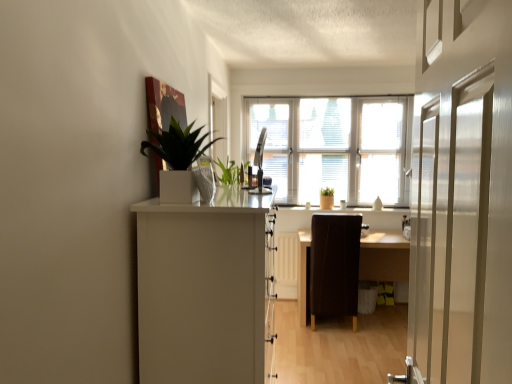
Question: Considering the relative positions of metallic silver monitor at center and wooden table at center in the image provided, is metallic silver monitor at center in front of wooden table at center?

Choices:
 (A) yes
 (B) no

Answer: (A)

Question: Is metallic silver monitor at center not near wooden table at center?

Choices:
 (A) no
 (B) yes

Answer: (B)

Question: Does metallic silver monitor at center have a larger size compared to wooden table at center?

Choices:
 (A) yes
 (B) no

Answer: (B)

Question: Is the position of metallic silver monitor at center more distant than that of wooden table at center?

Choices:
 (A) no
 (B) yes

Answer: (A)

Question: Is metallic silver monitor at center oriented away from wooden table at center?

Choices:
 (A) yes
 (B) no

Answer: (B)

Question: Considering the relative sizes of metallic silver monitor at center and wooden table at center in the image provided, is metallic silver monitor at center thinner than wooden table at center?

Choices:
 (A) yes
 (B) no

Answer: (A)

Question: From a real-world perspective, does white glossy window at center stand above metallic silver monitor at center?

Choices:
 (A) no
 (B) yes

Answer: (B)

Question: Is the position of white glossy window at center more distant than that of metallic silver monitor at center?

Choices:
 (A) no
 (B) yes

Answer: (B)

Question: Considering the relative positions of white glossy window at center and metallic silver monitor at center in the image provided, is white glossy window at center in front of metallic silver monitor at center?

Choices:
 (A) yes
 (B) no

Answer: (B)

Question: Is white glossy window at center shorter than metallic silver monitor at center?

Choices:
 (A) yes
 (B) no

Answer: (B)

Question: Can you confirm if white glossy window at center is wider than metallic silver monitor at center?

Choices:
 (A) yes
 (B) no

Answer: (A)

Question: From a real-world perspective, is white glossy window at center beneath metallic silver monitor at center?

Choices:
 (A) yes
 (B) no

Answer: (B)

Question: Does brown leather chair at center have a greater width compared to wooden table at center?

Choices:
 (A) yes
 (B) no

Answer: (B)